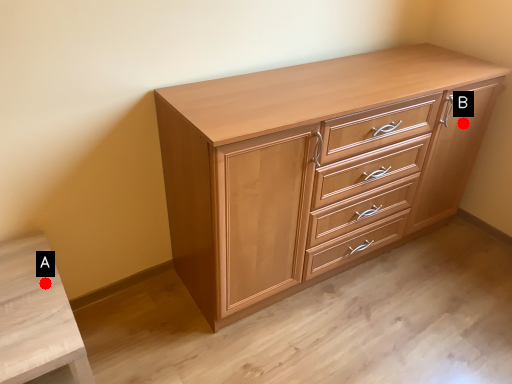
Question: Two points are circled on the image, labeled by A and B beside each circle. Which point is farther to the camera?

Choices:
 (A) A is further
 (B) B is further

Answer: (B)